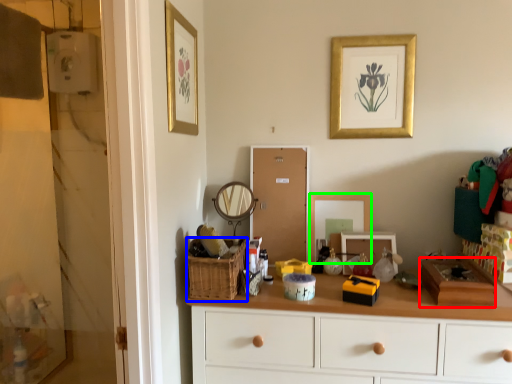
Question: Which object is the closest to the box (highlighted by a red box)? Choose among these: basket (highlighted by a blue box) or mirror (highlighted by a green box).

Choices:
 (A) basket
 (B) mirror

Answer: (B)